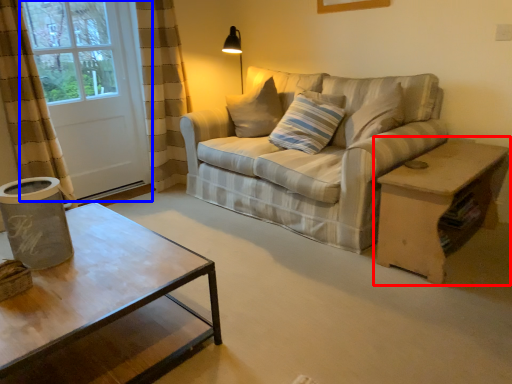
Question: Which object is further to the camera taking this photo, table (highlighted by a red box) or screen door (highlighted by a blue box)?

Choices:
 (A) table
 (B) screen door

Answer: (B)